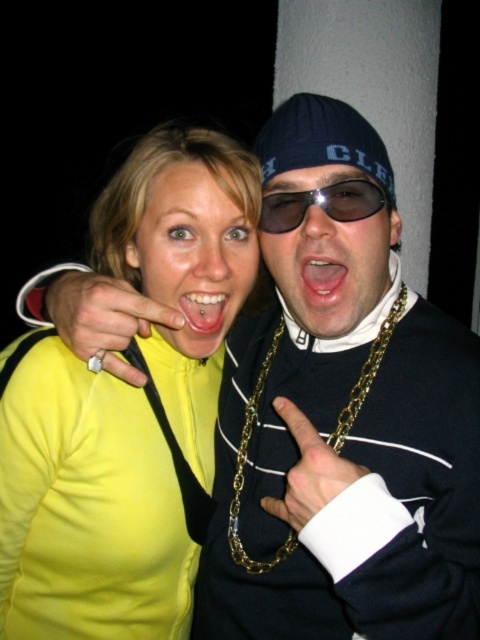
Is sunglasses at center positioned in front of pink glossy lips at center?

That is False.

The width and height of the screenshot is (480, 640). Describe the element at coordinates (322, 204) in the screenshot. I see `sunglasses at center` at that location.

Between point (350, 179) and point (332, 298), which one is positioned behind?

Point (332, 298)

Find the location of `sunglasses at center`. sunglasses at center is located at coordinates (322, 204).

Which is behind, point (333, 289) or point (192, 305)?

The point (192, 305) is behind.

Based on the photo, is pink glossy lips at center smaller than pierced flesh at center?

Indeed, pink glossy lips at center has a smaller size compared to pierced flesh at center.

The image size is (480, 640). What do you see at coordinates (322, 278) in the screenshot?
I see `pink glossy lips at center` at bounding box center [322, 278].

This screenshot has width=480, height=640. In order to click on pink glossy lips at center in this screenshot , I will do 322,278.

Which of these two, yellow matte jacket at center or matte black sunglasses at center, stands shorter?

Standing shorter between the two is matte black sunglasses at center.

Between point (141, 344) and point (300, 282), which one is positioned behind?

The point (141, 344) is behind.

Locate an element on the screen. The height and width of the screenshot is (640, 480). yellow matte jacket at center is located at coordinates (87, 508).